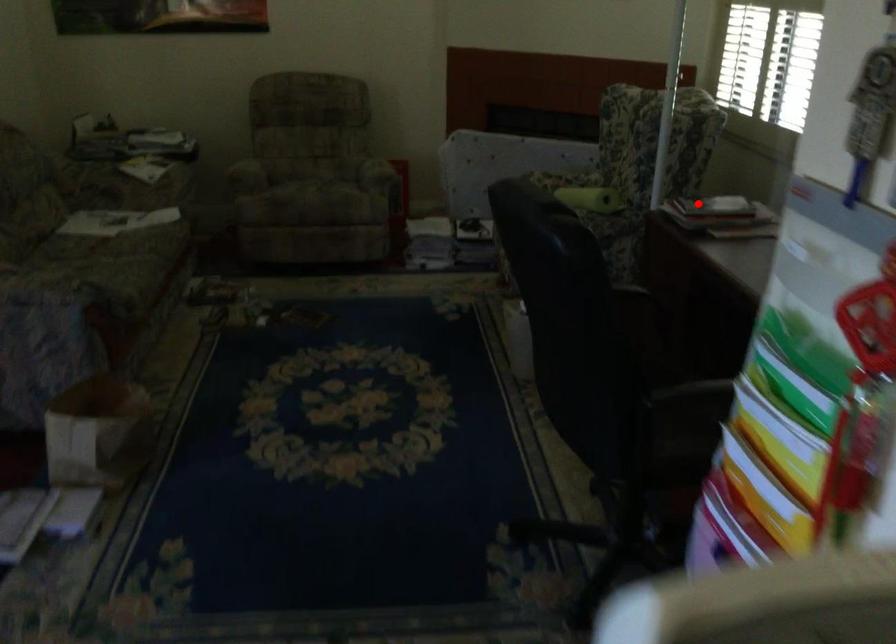
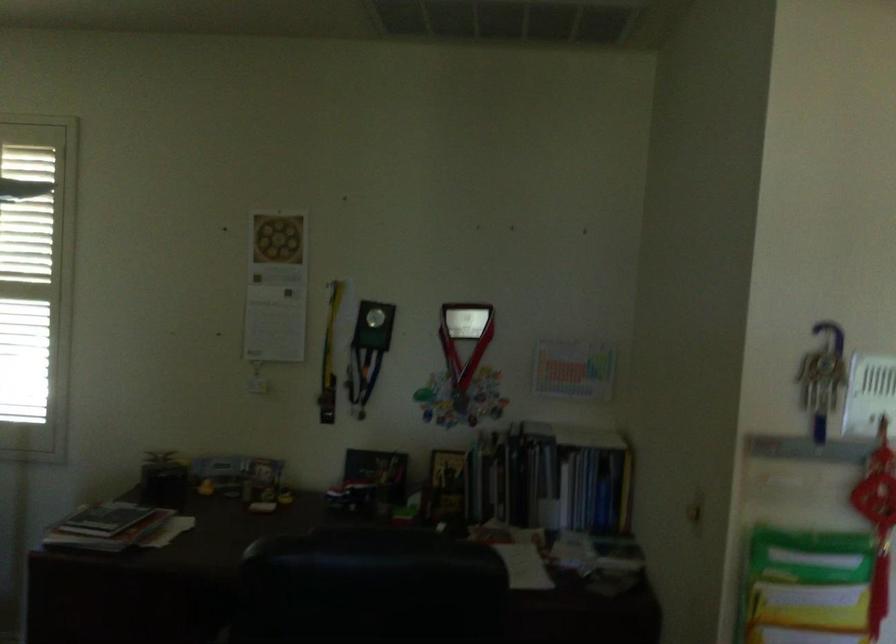
Locate, in the second image, the point that corresponds to the highlighted location in the first image.

(104, 518)